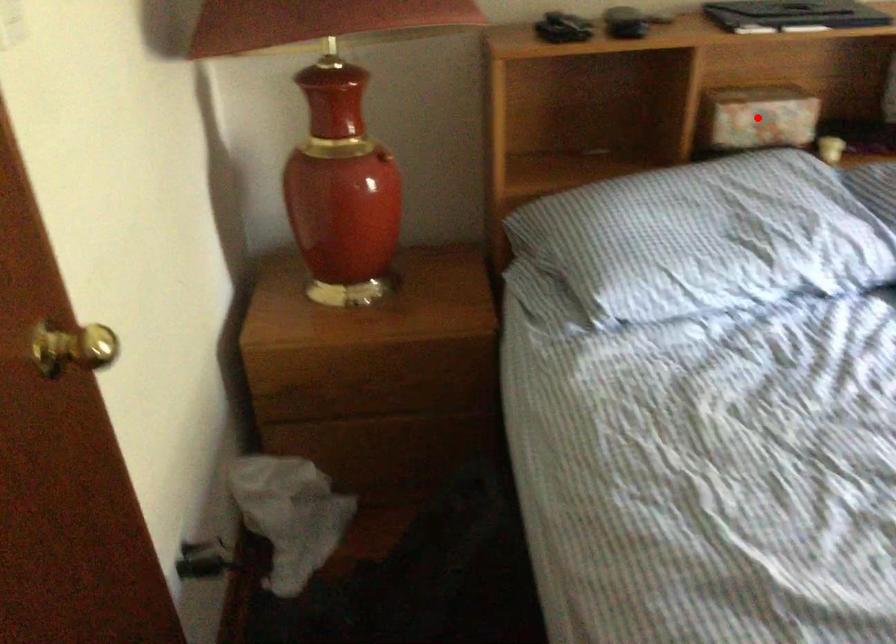
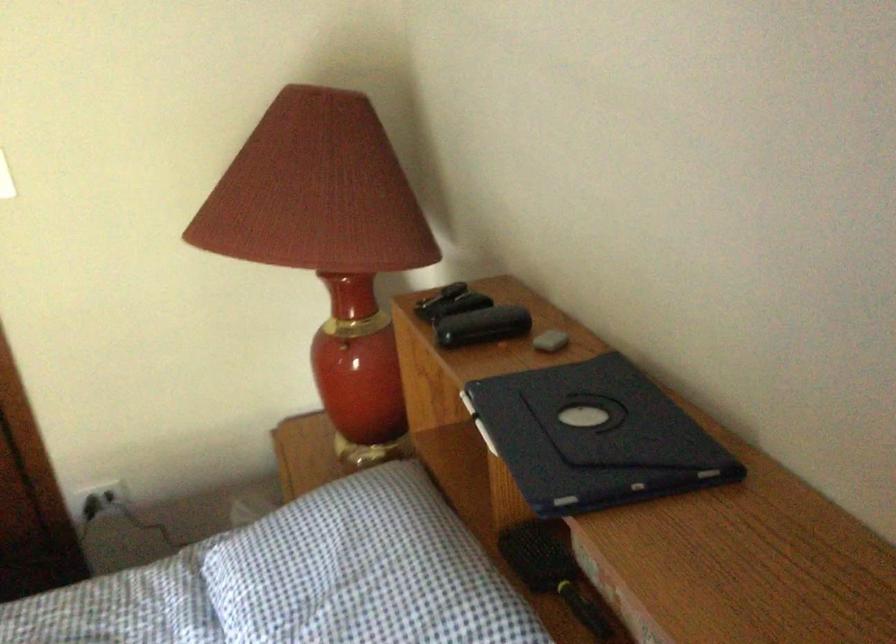
Question: I am providing you with two images of the same scene from different viewpoints. A red point is marked on the first image. Is the red point's position out of view in image 2?

Choices:
 (A) Yes
 (B) No

Answer: (A)